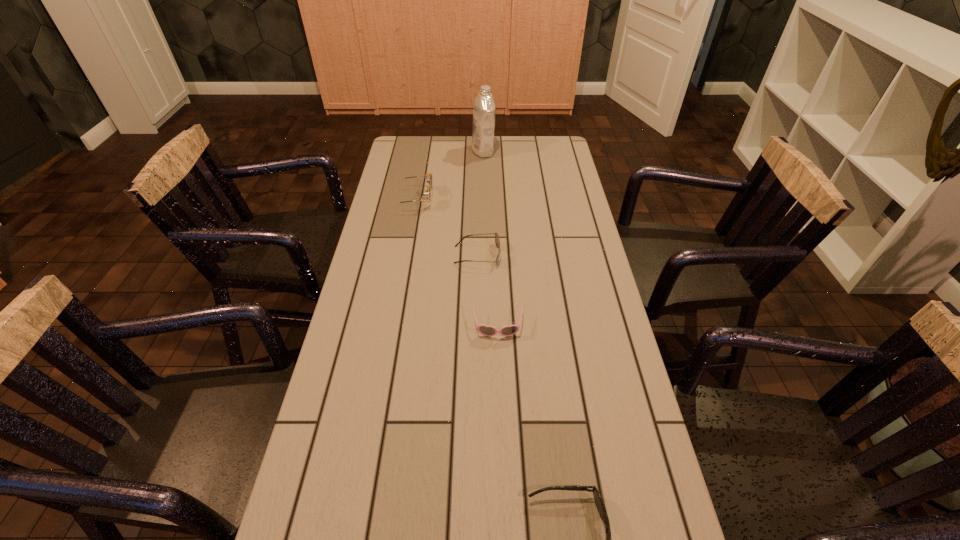
Identify the location of blank region between the detergent and the leftmost sunglasses. (448, 175).

This screenshot has height=540, width=960. I want to click on vacant space that's between the second tallest object and the second farthest sunglasses, so click(445, 227).

The image size is (960, 540). I want to click on unoccupied position between the farthest object and the third nearest object, so click(480, 203).

Locate an element on the screen. free space that is in between the second nearest object and the farthest object is located at coordinates (491, 239).

At what (x,y) coordinates should I click in order to perform the action: click on object that is the third closest to the nearest sunglasses. Please return your answer as a coordinate pair (x, y). Looking at the image, I should click on (428, 177).

Point out which object is positioned as the fourth nearest to the nearest object. Please provide its 2D coordinates. Your answer should be formatted as a tuple, i.e. [(x, y)], where the tuple contains the x and y coordinates of a point satisfying the conditions above.

[(482, 144)]

Select which sunglasses is the third closest to the second nearest object. Please provide its 2D coordinates. Your answer should be formatted as a tuple, i.e. [(x, y)], where the tuple contains the x and y coordinates of a point satisfying the conditions above.

[(428, 177)]

Locate which sunglasses ranks second in proximity to the leftmost sunglasses. Please provide its 2D coordinates. Your answer should be formatted as a tuple, i.e. [(x, y)], where the tuple contains the x and y coordinates of a point satisfying the conditions above.

[(485, 330)]